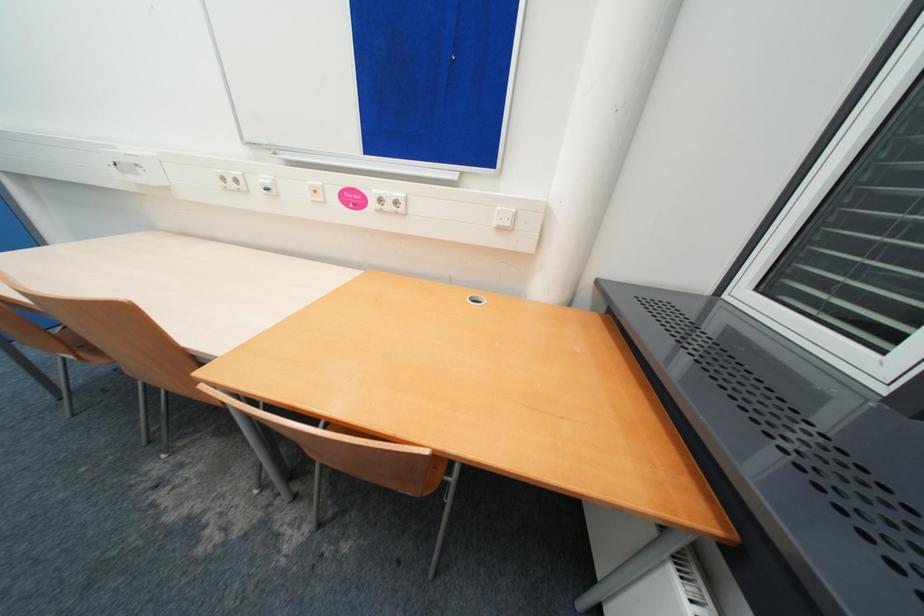
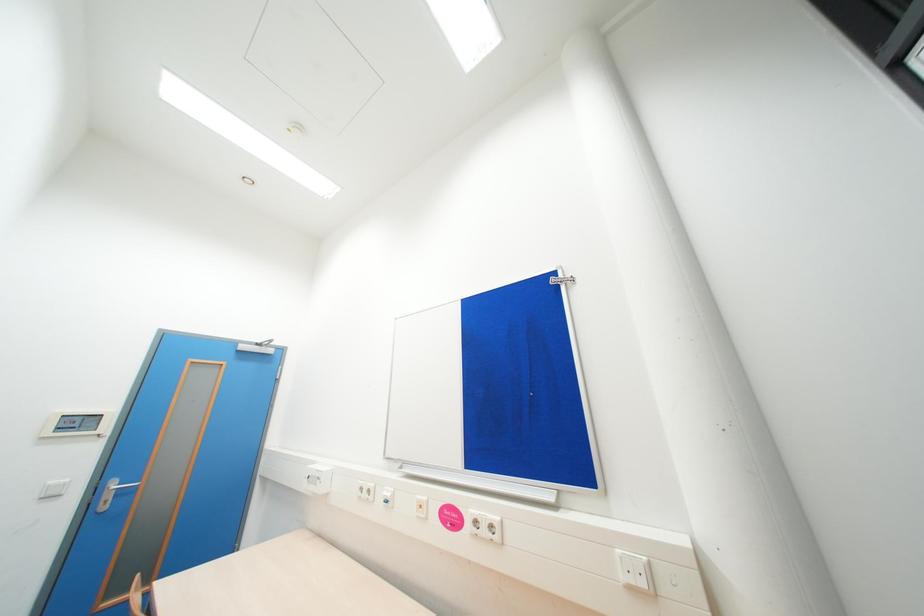
First-person continuous shooting, in which direction is the camera rotating?

The camera's rotation is toward left-up.